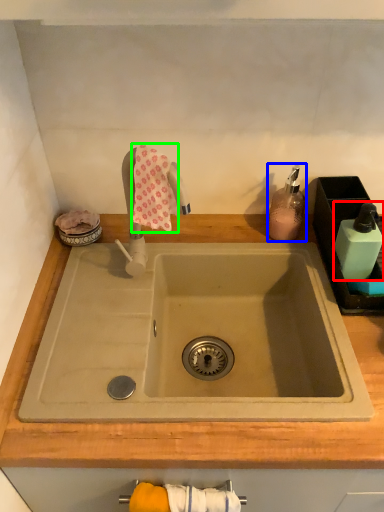
Question: Which object is the farthest from toiletry (highlighted by a red box)? Choose among these: soap dispenser (highlighted by a blue box) or bath towel (highlighted by a green box).

Choices:
 (A) soap dispenser
 (B) bath towel

Answer: (B)